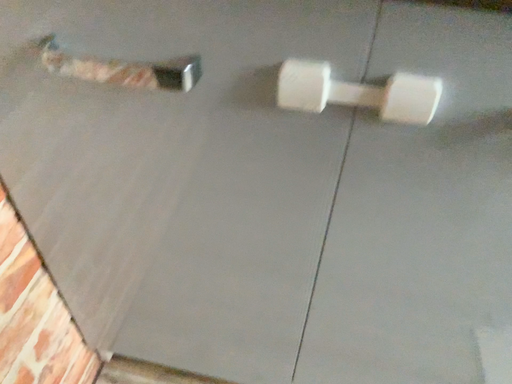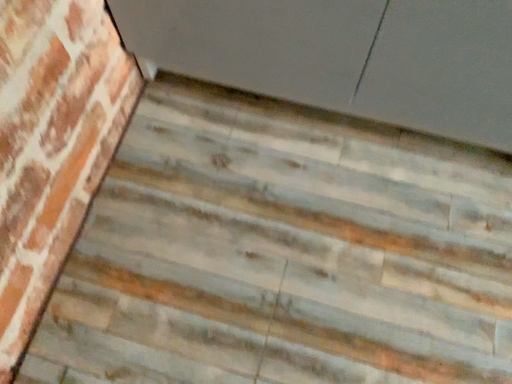
Question: How did the camera likely rotate when shooting the video?

Choices:
 (A) rotated upward
 (B) rotated downward

Answer: (B)